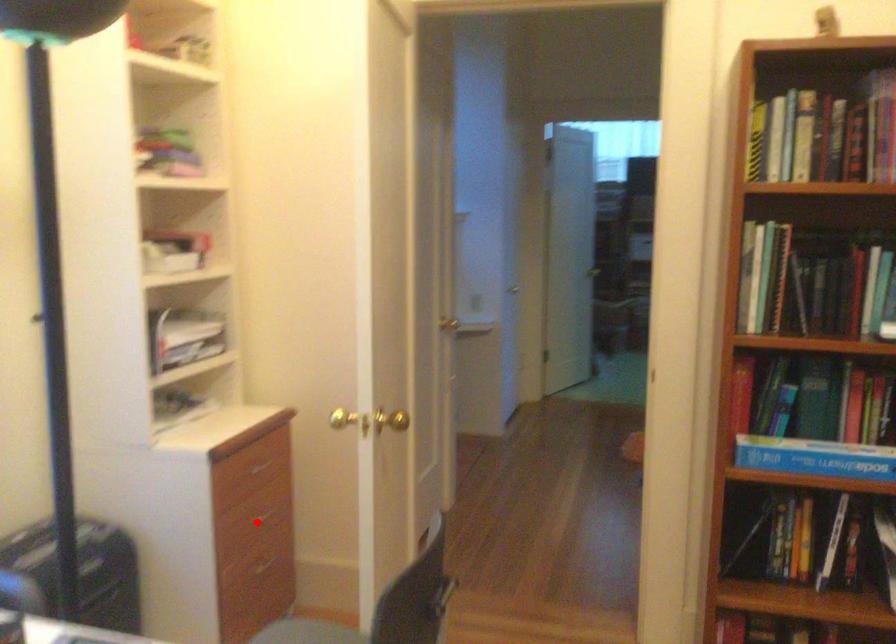
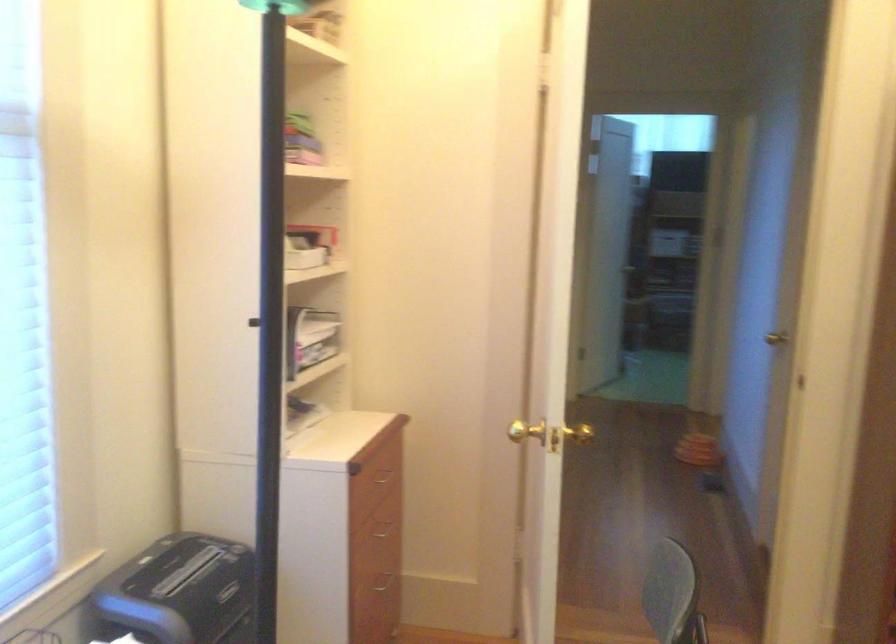
Locate, in the second image, the point that corresponds to the highlighted location in the first image.

(382, 534)